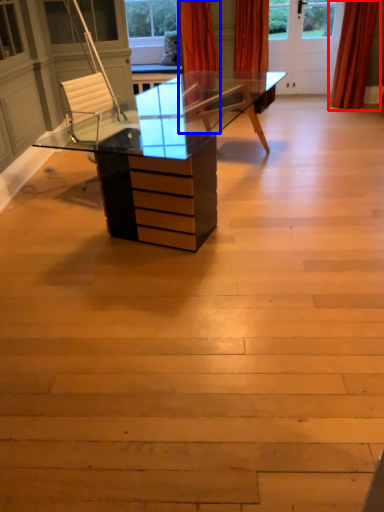
Question: Among these objects, which one is farthest to the camera, curtain (highlighted by a red box) or curtain (highlighted by a blue box)?

Choices:
 (A) curtain
 (B) curtain

Answer: (A)